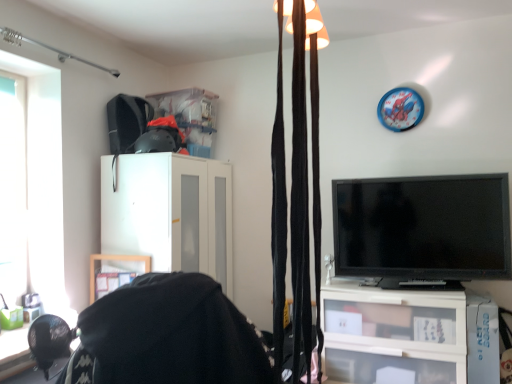
The image size is (512, 384). I want to click on black velvet curtains at upper center, so click(x=300, y=201).

What do you see at coordinates (400, 109) in the screenshot? The image size is (512, 384). I see `blue plastic clock at upper right` at bounding box center [400, 109].

Locate an element on the screen. The width and height of the screenshot is (512, 384). white matte cabinet at center is located at coordinates [x=170, y=213].

You are a GUI agent. You are given a task and a screenshot of the screen. Output one action in this format:
    pyautogui.click(x=<x>, y=<y>)
    Task: Click on the black velvet curtains at upper center
    
    Given the screenshot: What is the action you would take?
    pyautogui.click(x=300, y=201)

Is point (117, 292) closer or farther from the camera than point (393, 105)?

Point (117, 292) is positioned closer to the camera compared to point (393, 105).

From a real-world perspective, is black fabric bean bag chair at lower left positioned over blue plastic clock at upper right based on gravity?

No, from a real-world perspective, black fabric bean bag chair at lower left is not above blue plastic clock at upper right.

Is black fabric bean bag chair at lower left facing away from blue plastic clock at upper right?

No, black fabric bean bag chair at lower left is not facing away from blue plastic clock at upper right.

From the image's perspective, does black fabric bean bag chair at lower left appear lower than blue plastic clock at upper right?

Correct, black fabric bean bag chair at lower left appears lower than blue plastic clock at upper right in the image.

Is black fabric bean bag chair at lower left at the left side of black velvet curtains at upper center?

Correct, you'll find black fabric bean bag chair at lower left to the left of black velvet curtains at upper center.

From the image's perspective, is black fabric bean bag chair at lower left over black velvet curtains at upper center?

No, from the image's perspective, black fabric bean bag chair at lower left is not on top of black velvet curtains at upper center.

Between black fabric bean bag chair at lower left and black velvet curtains at upper center, which one has smaller size?

black velvet curtains at upper center is smaller.

Between black fabric bean bag chair at lower left and white matte cabinet at center, which one has smaller width?

black fabric bean bag chair at lower left is thinner.

Which object is closer to the camera, black fabric bean bag chair at lower left or white matte cabinet at center?

Positioned in front is black fabric bean bag chair at lower left.

From the image's perspective, is black fabric bean bag chair at lower left over white matte cabinet at center?

No, from the image's perspective, black fabric bean bag chair at lower left is not over white matte cabinet at center.

How many degrees apart are the facing directions of blue plastic clock at upper right and white matte cabinet at center?

The facing directions of blue plastic clock at upper right and white matte cabinet at center are 89.4 degrees apart.

Is blue plastic clock at upper right far from white matte cabinet at center?

Yes.

Does blue plastic clock at upper right have a greater width compared to white matte cabinet at center?

Incorrect, the width of blue plastic clock at upper right does not surpass that of white matte cabinet at center.

Consider the image. Which is more to the right, blue plastic clock at upper right or white matte cabinet at center?

blue plastic clock at upper right.

This screenshot has width=512, height=384. I want to click on bean bag chair below the black velvet curtains at upper center (from the image's perspective), so click(x=168, y=336).

Is black velvet curtains at upper center to the left or to the right of black fabric bean bag chair at lower left in the image?

black velvet curtains at upper center is positioned on black fabric bean bag chair at lower left's right side.

How much distance is there between black velvet curtains at upper center and black fabric bean bag chair at lower left?

black velvet curtains at upper center is 30.09 centimeters from black fabric bean bag chair at lower left.

Which of these two, black velvet curtains at upper center or black fabric bean bag chair at lower left, is wider?

black fabric bean bag chair at lower left.

Is black velvet curtains at upper center looking in the opposite direction of white matte cabinet at center?

That's not correct — black velvet curtains at upper center is not looking away from white matte cabinet at center.

From a real-world perspective, is black velvet curtains at upper center above or below white matte cabinet at center?

black velvet curtains at upper center is above white matte cabinet at center.

In the image, is black velvet curtains at upper center positioned in front of or behind white matte cabinet at center?

black velvet curtains at upper center is in front of white matte cabinet at center.

Is black glossy tv at right at the right side of blue plastic clock at upper right?

No, black glossy tv at right is not to the right of blue plastic clock at upper right.

What are the coordinates of `clock that appears above the black glossy tv at right (from the image's perspective)` in the screenshot? It's located at point(400,109).

Is black glossy tv at right completely or partially outside of blue plastic clock at upper right?

black glossy tv at right is positioned outside blue plastic clock at upper right.

Considering the relative sizes of black glossy tv at right and blue plastic clock at upper right in the image provided, is black glossy tv at right bigger than blue plastic clock at upper right?

Indeed, black glossy tv at right has a larger size compared to blue plastic clock at upper right.

Where is `clock above the black fabric bean bag chair at lower left (from the image's perspective)`? This screenshot has width=512, height=384. clock above the black fabric bean bag chair at lower left (from the image's perspective) is located at coordinates (400, 109).

Locate an element on the screen. Image resolution: width=512 pixels, height=384 pixels. bean bag chair below the black velvet curtains at upper center (from the image's perspective) is located at coordinates (168, 336).

Which object lies further to the anchor point transparent glass window at left, blue plastic clock at upper right or black velvet curtains at upper center?

The object further to transparent glass window at left is blue plastic clock at upper right.

From the image, which object appears to be farther from black fabric bean bag chair at lower left, black velvet curtains at upper center or black glossy tv at right?

Among the two, black glossy tv at right is located further to black fabric bean bag chair at lower left.

Looking at the image, which one is located further to black glossy tv at right, blue plastic clock at upper right or white matte cabinet at center?

white matte cabinet at center is further to black glossy tv at right.

Which object lies nearer to the anchor point transparent glass window at left, white matte cabinet at center or black velvet curtains at upper center?

The object closer to transparent glass window at left is white matte cabinet at center.

Based on their spatial positions, is black fabric bean bag chair at lower left or black glossy tv at right further from blue plastic clock at upper right?

black fabric bean bag chair at lower left is positioned further to the anchor blue plastic clock at upper right.

From the picture: When comparing their distances from black glossy tv at right, does white matte cabinet at center or transparent glass window at left seem further?

Among the two, transparent glass window at left is located further to black glossy tv at right.

Estimate the real-world distances between objects in this image. Which object is further from transparent glass window at left, blue plastic clock at upper right or black fabric bean bag chair at lower left?

blue plastic clock at upper right is positioned further to the anchor transparent glass window at left.

Looking at the image, which one is located closer to blue plastic clock at upper right, black fabric bean bag chair at lower left or black velvet curtains at upper center?

black velvet curtains at upper center.

This screenshot has width=512, height=384. In order to click on television located between black fabric bean bag chair at lower left and blue plastic clock at upper right in the depth direction in this screenshot , I will do `click(423, 227)`.

Image resolution: width=512 pixels, height=384 pixels. I want to click on television between black velvet curtains at upper center and white matte cabinet at center along the z-axis, so click(423, 227).

Image resolution: width=512 pixels, height=384 pixels. What are the coordinates of `cabinetry between black velvet curtains at upper center and blue plastic clock at upper right in the front-back direction` in the screenshot? It's located at pyautogui.click(x=170, y=213).

Identify the location of curtain positioned between black fabric bean bag chair at lower left and transparent glass window at left from near to far. This screenshot has width=512, height=384. (300, 201).